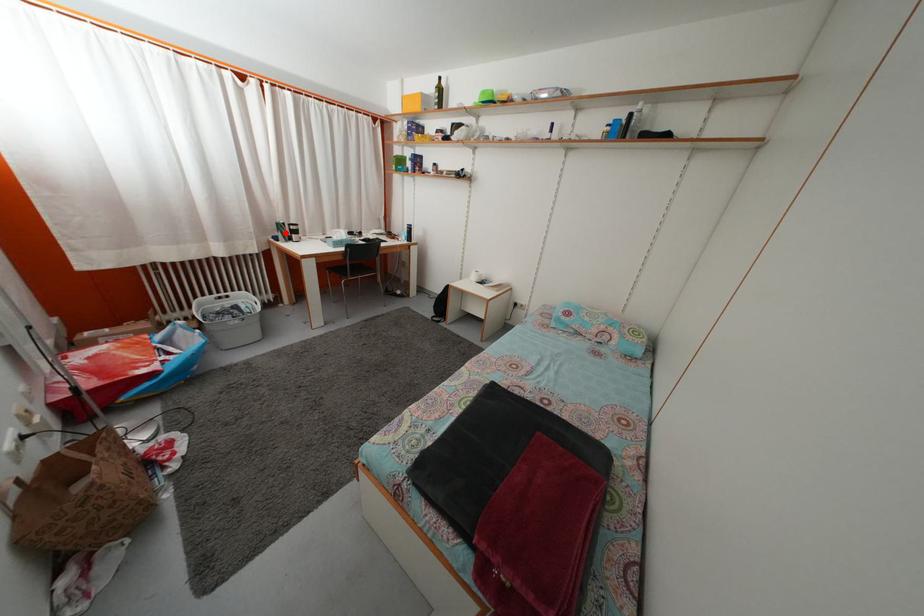
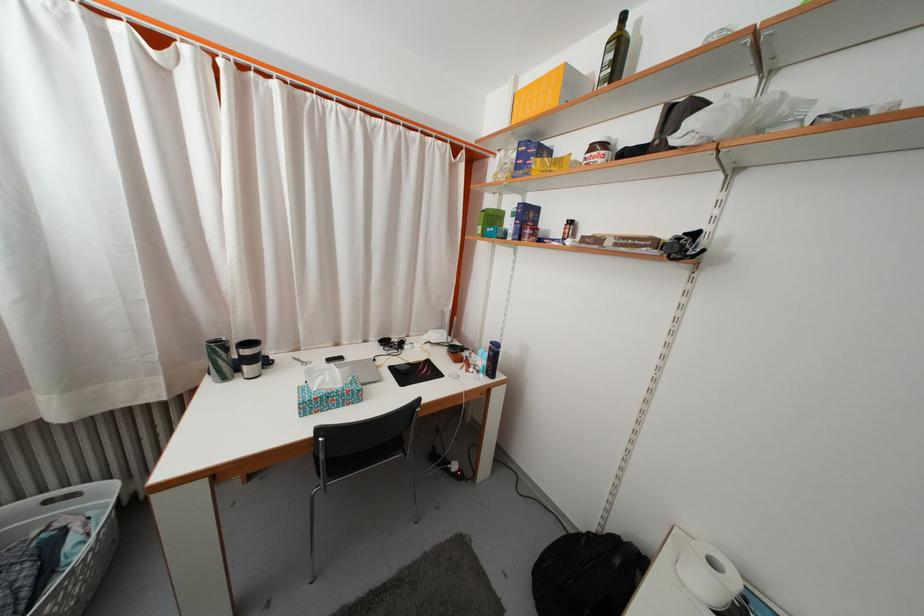
Question: I am providing you with two images of the same scene from different viewpoints. A red point is shown in image1. For the corresponding object point in image2, is it positioned nearer or farther from the camera?

Choices:
 (A) Nearer
 (B) Farther

Answer: (B)